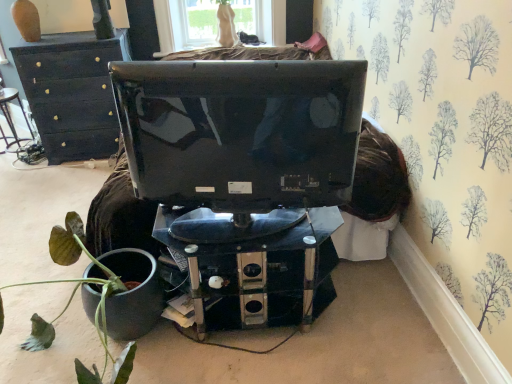
Question: Considering the relative sizes of green matte plant pot at lower left and glossy black monitor at center in the image provided, is green matte plant pot at lower left thinner than glossy black monitor at center?

Choices:
 (A) yes
 (B) no

Answer: (B)

Question: Considering the relative positions of green matte plant pot at lower left and glossy black monitor at center in the image provided, is green matte plant pot at lower left in front of glossy black monitor at center?

Choices:
 (A) no
 (B) yes

Answer: (B)

Question: Can you confirm if green matte plant pot at lower left is taller than glossy black monitor at center?

Choices:
 (A) no
 (B) yes

Answer: (A)

Question: Can you confirm if green matte plant pot at lower left is shorter than glossy black monitor at center?

Choices:
 (A) no
 (B) yes

Answer: (B)

Question: From a real-world perspective, is green matte plant pot at lower left physically below glossy black monitor at center?

Choices:
 (A) no
 (B) yes

Answer: (B)

Question: Is glossy black monitor at center in front of or behind green matte plant pot at lower left in the image?

Choices:
 (A) front
 (B) behind

Answer: (B)

Question: From the image's perspective, is glossy black monitor at center above or below green matte plant pot at lower left?

Choices:
 (A) above
 (B) below

Answer: (A)

Question: Would you say glossy black monitor at center is to the left or to the right of green matte plant pot at lower left in the picture?

Choices:
 (A) left
 (B) right

Answer: (B)

Question: Does point (316, 110) appear closer or farther from the camera than point (70, 301)?

Choices:
 (A) closer
 (B) farther

Answer: (A)

Question: From a real-world perspective, is transparent glass window at upper center physically located above or below glossy black monitor at center?

Choices:
 (A) below
 (B) above

Answer: (B)

Question: Does point (168, 46) appear closer or farther from the camera than point (305, 119)?

Choices:
 (A) farther
 (B) closer

Answer: (A)

Question: From the image's perspective, is transparent glass window at upper center located above or below glossy black monitor at center?

Choices:
 (A) below
 (B) above

Answer: (B)

Question: Which is correct: transparent glass window at upper center is inside glossy black monitor at center, or outside of it?

Choices:
 (A) outside
 (B) inside

Answer: (A)

Question: Is black wood dresser at upper left bigger or smaller than transparent glass window at upper center?

Choices:
 (A) small
 (B) big

Answer: (B)

Question: Does point [x=55, y=91] appear closer or farther from the camera than point [x=177, y=38]?

Choices:
 (A) farther
 (B) closer

Answer: (B)